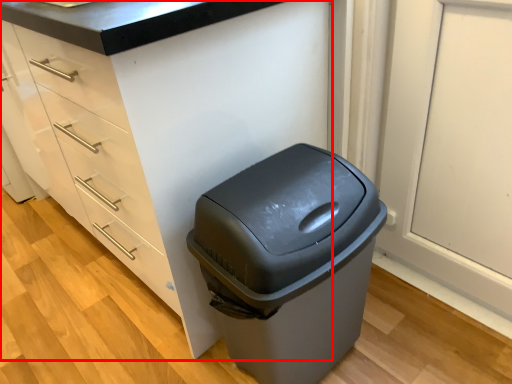
Question: From the image's perspective, considering the relative positions of cabinetry (annotated by the red box) and waste container in the image provided, where is cabinetry (annotated by the red box) located with respect to the staircase?

Choices:
 (A) above
 (B) below

Answer: (A)